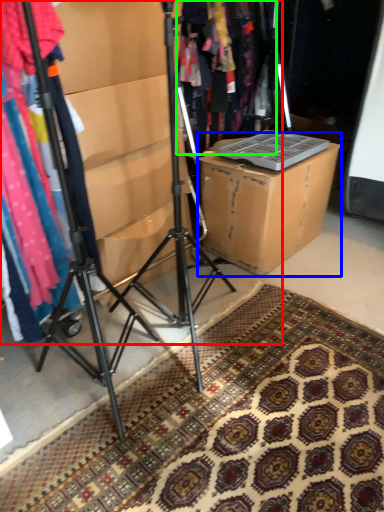
Question: Which object is positioned closest to closet (highlighted by a red box)? Select from cardboard box (highlighted by a blue box) and clothing (highlighted by a green box).

Choices:
 (A) cardboard box
 (B) clothing

Answer: (A)